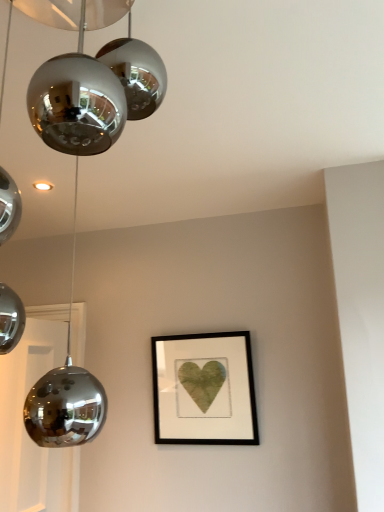
Question: Based on their sizes in the image, would you say polished chrome globe at upper left is bigger or smaller than matte black frame at center?

Choices:
 (A) small
 (B) big

Answer: (B)

Question: Considering the positions of point (41, 67) and point (162, 357), is point (41, 67) closer or farther from the camera than point (162, 357)?

Choices:
 (A) closer
 (B) farther

Answer: (A)

Question: Considering the positions of polished chrome globe at upper left and matte black frame at center in the image, is polished chrome globe at upper left taller or shorter than matte black frame at center?

Choices:
 (A) short
 (B) tall

Answer: (B)

Question: Relative to polished chrome globe at upper left, is matte black frame at center in front or behind?

Choices:
 (A) front
 (B) behind

Answer: (B)

Question: In terms of height, does matte black frame at center look taller or shorter compared to polished chrome globe at upper left?

Choices:
 (A) tall
 (B) short

Answer: (B)

Question: From the image's perspective, is matte black frame at center above or below polished chrome globe at upper left?

Choices:
 (A) above
 (B) below

Answer: (B)

Question: From a real-world perspective, is matte black frame at center above or below polished chrome globe at upper left?

Choices:
 (A) below
 (B) above

Answer: (A)